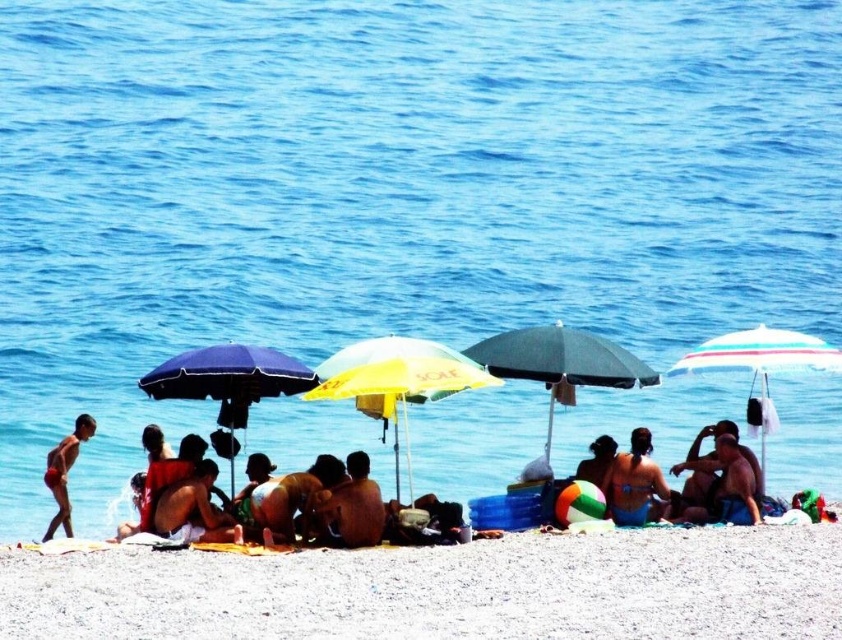
You are a beachgoer who wants to move from the striped fabric umbrella at right to the beige fabric towel at center. Which direction should you walk to get there?

The striped fabric umbrella at right is positioned on the right side of beige fabric towel at center, so you should walk to the left to reach the beige fabric towel at center from the striped fabric umbrella at right.